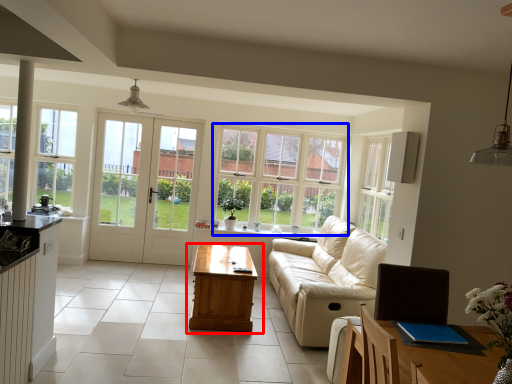
Question: Which of the following is the farthest to the observer, table (highlighted by a red box) or window (highlighted by a blue box)?

Choices:
 (A) table
 (B) window

Answer: (B)